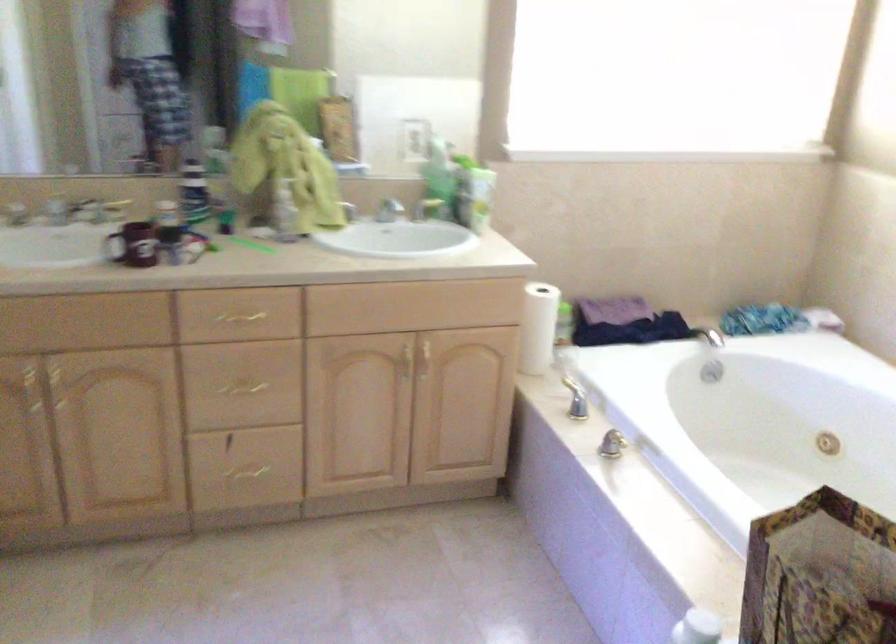
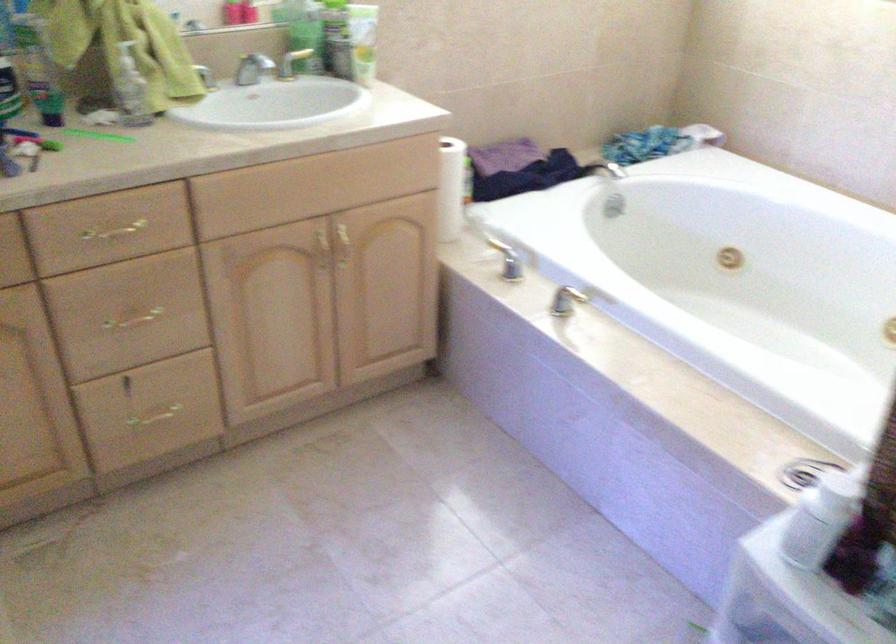
Locate, in the second image, the point that corresponds to the point at 244,471 in the first image.

(154, 415)